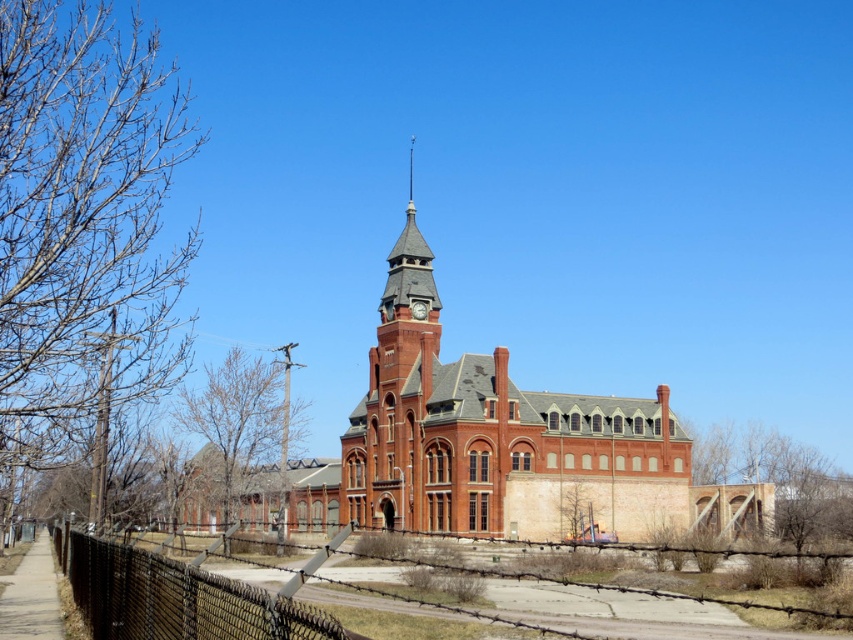
Does red brick church at center have a greater width compared to chain-link fence at lower left?

Correct, the width of red brick church at center exceeds that of chain-link fence at lower left.

Is red brick church at center smaller than chain-link fence at lower left?

Actually, red brick church at center might be larger than chain-link fence at lower left.

The width and height of the screenshot is (853, 640). I want to click on red brick church at center, so click(503, 444).

Is chain-link fence at lower left below matte gray clock at center?

Yes.

Which is more to the left, chain-link fence at lower left or matte gray clock at center?

Positioned to the left is chain-link fence at lower left.

This screenshot has width=853, height=640. What are the coordinates of `chain-link fence at lower left` in the screenshot? It's located at (177, 596).

Can you confirm if black chain-link fence at lower left is shorter than matte gray clock at center?

Incorrect, black chain-link fence at lower left's height does not fall short of matte gray clock at center's.

Who is more distant from viewer, (70, 570) or (421, 316)?

Point (421, 316)

Where is `black chain-link fence at lower left`? black chain-link fence at lower left is located at coordinates (177, 596).